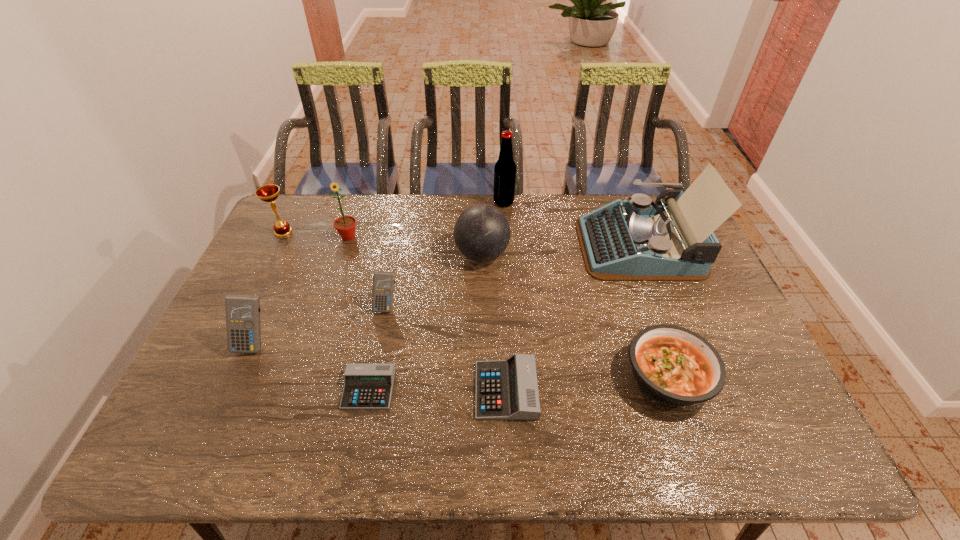
This screenshot has height=540, width=960. I want to click on stew, so click(x=675, y=366).

At what (x,y) coordinates should I click in order to perform the action: click on the right gray calculator. Please return your answer as a coordinate pair (x, y). The width and height of the screenshot is (960, 540). Looking at the image, I should click on (507, 389).

This screenshot has width=960, height=540. In order to click on the ninth tallest object in this screenshot , I will do `click(507, 389)`.

At what (x,y) coordinates should I click in order to perform the action: click on the shortest object. Please return your answer as a coordinate pair (x, y). The image size is (960, 540). Looking at the image, I should click on (366, 386).

Identify the location of the left gray calculator. This screenshot has height=540, width=960. (366, 386).

You are a GUI agent. You are given a task and a screenshot of the screen. Output one action in this format:
    pyautogui.click(x=<x>, y=<y>)
    Task: Click on the free region located 0.330m on the right of the beer bottle
    The height and width of the screenshot is (540, 960).
    Given the screenshot: What is the action you would take?
    pyautogui.click(x=604, y=202)

Identify the location of free space located 0.390m on the typing side of the typewriter. The image size is (960, 540). [x=463, y=245].

In order to click on free space located on the typing side of the typewriter in this screenshot , I will do `click(511, 245)`.

This screenshot has width=960, height=540. I want to click on blank area located on the typing side of the typewriter, so click(x=532, y=245).

This screenshot has width=960, height=540. What are the coordinates of `vacant area situated 0.050m on the face of the eighth object from right to left` in the screenshot? It's located at (343, 254).